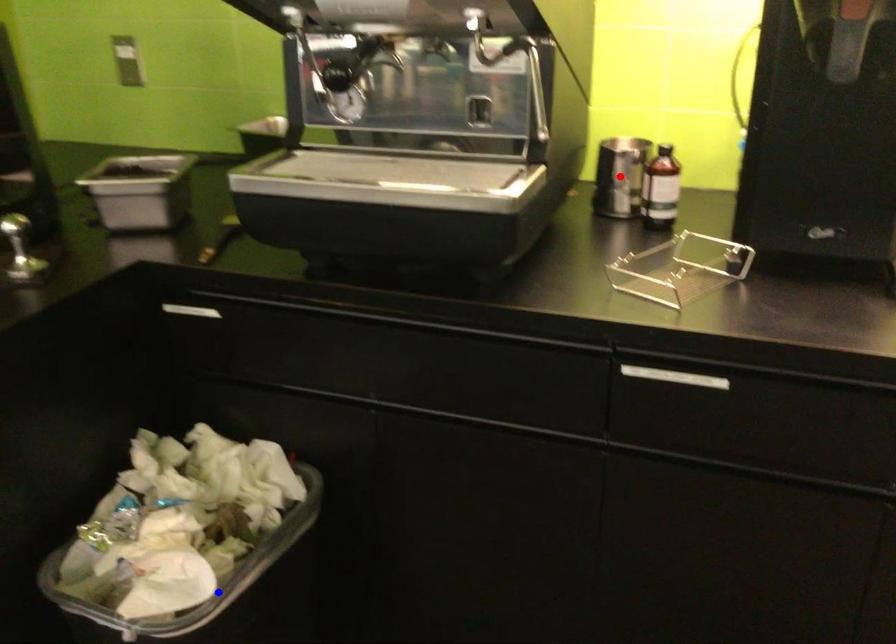
Question: In the image, two points are highlighted. Which point is nearer to the camera? Reply with the corresponding letter.

Choices:
 (A) blue point
 (B) red point

Answer: (A)